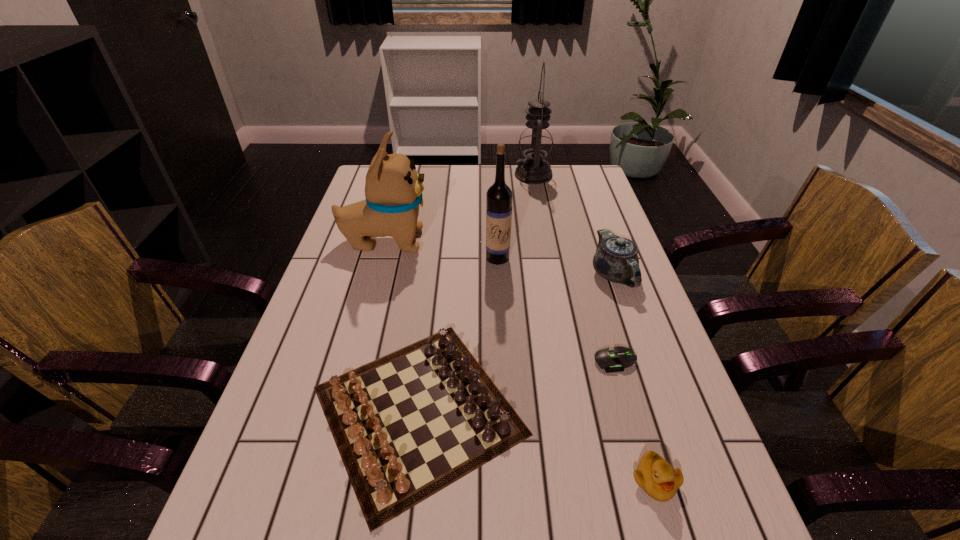
I want to click on object that is at the far right corner, so click(536, 140).

Image resolution: width=960 pixels, height=540 pixels. In the image, there is a desktop. In order to click on vacant space at the far edge in this screenshot , I will do `click(469, 168)`.

At what (x,y) coordinates should I click in order to perform the action: click on vacant area at the left edge. Please return your answer as a coordinate pair (x, y). The image size is (960, 540). Looking at the image, I should click on (329, 277).

You are a GUI agent. You are given a task and a screenshot of the screen. Output one action in this format:
    pyautogui.click(x=<x>, y=<y>)
    Task: Click on the vacant space at the right edge
    The width and height of the screenshot is (960, 540).
    Given the screenshot: What is the action you would take?
    pyautogui.click(x=653, y=316)

Where is `vacant region at the far right corner of the desktop`? vacant region at the far right corner of the desktop is located at coordinates (576, 180).

The height and width of the screenshot is (540, 960). Find the location of `vacant area between the puppy and the chessboard`. vacant area between the puppy and the chessboard is located at coordinates (401, 326).

You are a GUI agent. You are given a task and a screenshot of the screen. Output one action in this format:
    pyautogui.click(x=<x>, y=<y>)
    Task: Click on the free space between the fourth tallest object and the oil lamp
    
    Given the screenshot: What is the action you would take?
    pyautogui.click(x=573, y=225)

This screenshot has height=540, width=960. Find the location of `free space between the oil lamp and the puppy`. free space between the oil lamp and the puppy is located at coordinates (459, 208).

Image resolution: width=960 pixels, height=540 pixels. In order to click on free space between the puppy and the chessboard in this screenshot , I will do `click(401, 326)`.

You are a GUI agent. You are given a task and a screenshot of the screen. Output one action in this format:
    pyautogui.click(x=<x>, y=<y>)
    Task: Click on the unoccupied area between the puppy and the computer mouse
    Image resolution: width=960 pixels, height=540 pixels.
    Given the screenshot: What is the action you would take?
    pyautogui.click(x=500, y=301)